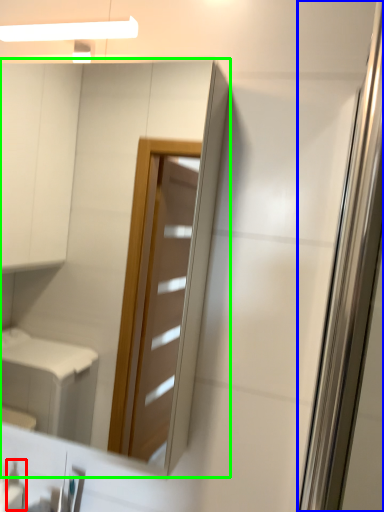
Question: Which object is positioned farthest from toiletry (highlighted by a red box)? Select from screen door (highlighted by a blue box) and mirror (highlighted by a green box).

Choices:
 (A) screen door
 (B) mirror

Answer: (B)